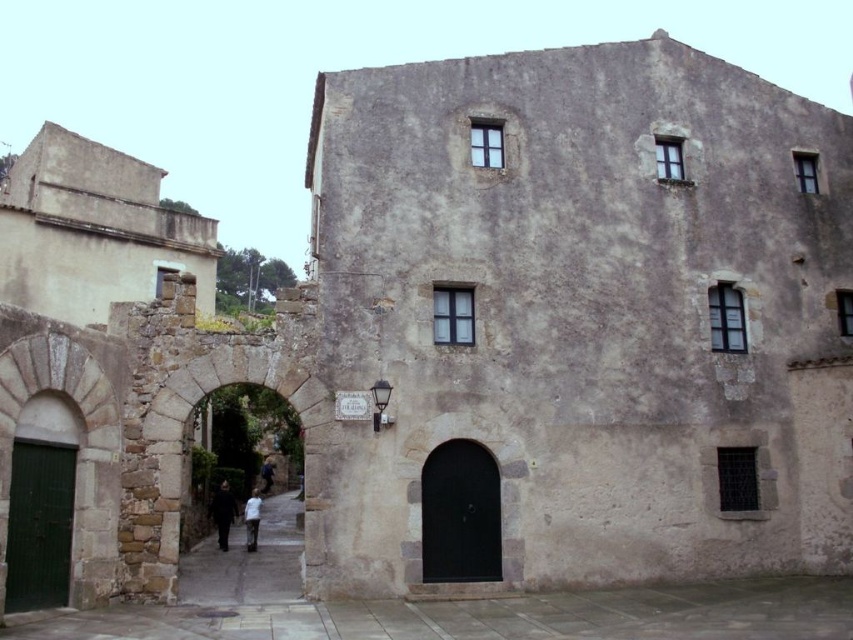
Question: Does black matte coat at center appear on the right side of white cotton shirt at center?

Choices:
 (A) yes
 (B) no

Answer: (B)

Question: Which of the following is the closest to the observer?

Choices:
 (A) white cotton shirt at center
 (B) dark blue jeans at center
 (C) dark gray stone alley at center
 (D) black matte coat at center

Answer: (C)

Question: Can you confirm if black matte coat at center is positioned below white cotton shirt at center?

Choices:
 (A) yes
 (B) no

Answer: (B)

Question: Which point is closer to the camera?

Choices:
 (A) (260, 492)
 (B) (268, 582)

Answer: (B)

Question: Which object is farther from the camera taking this photo?

Choices:
 (A) dark blue jeans at center
 (B) dark gray stone alley at center

Answer: (A)

Question: Does dark gray stone alley at center appear under black matte coat at center?

Choices:
 (A) no
 (B) yes

Answer: (B)